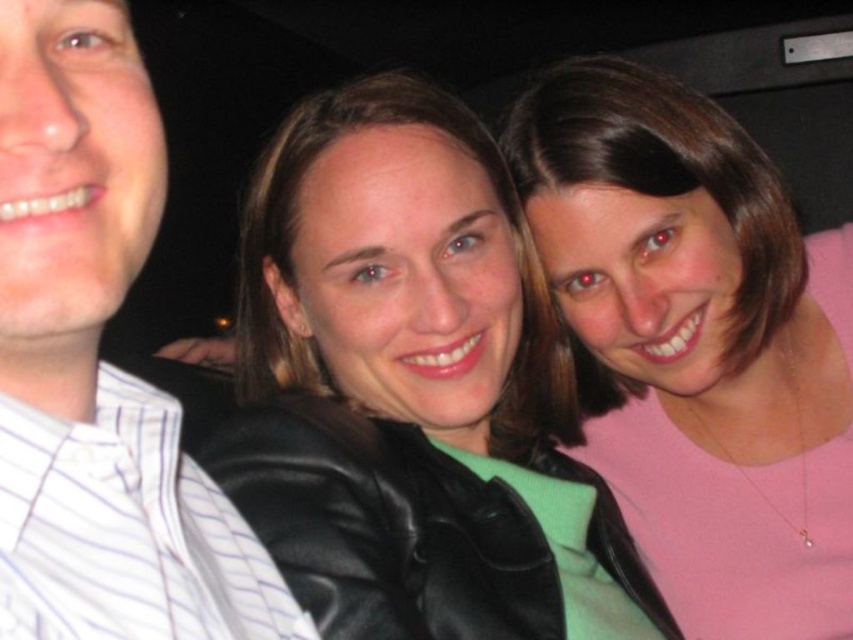
Based on the scene description, can you determine which object is taller between the black leather jacket at center and the white striped shirt at left?

The black leather jacket at center is taller than the white striped shirt at left according to the description.

You are trying to decide which shirt to wear for a casual dinner. Both the pink matte shirt at center and the white striped shirt at left are options. Based on their sizes in the image, which one would you choose if you prefer a more oversized look?

The pink matte shirt at center is larger in size compared to the white striped shirt at left, so it would be the better choice for an oversized look.